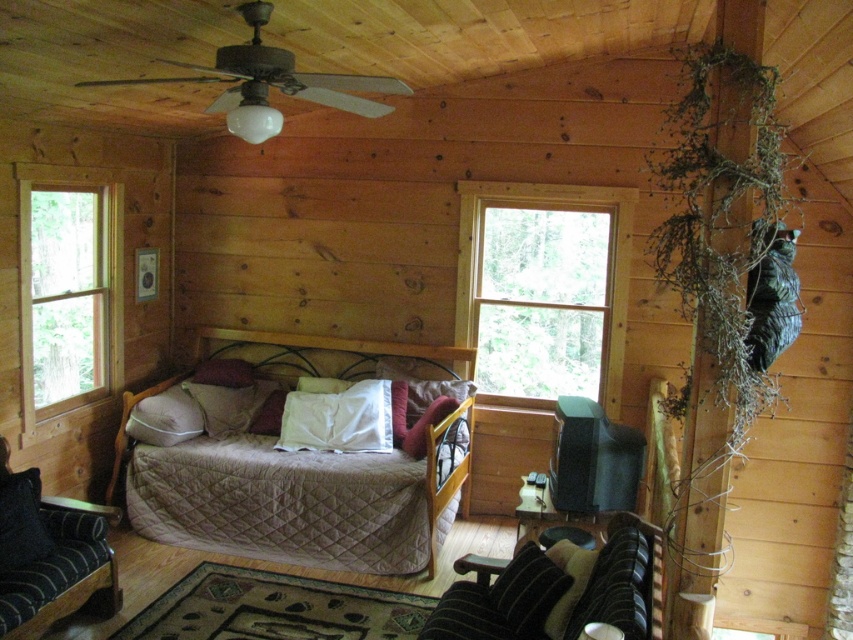
Question: Among these points, which one is nearest to the camera?

Choices:
 (A) (300, 392)
 (B) (509, 579)
 (C) (173, 406)
 (D) (334, 337)

Answer: (B)

Question: Where is clear glass window at left located in relation to white soft pillow at center in the image?

Choices:
 (A) above
 (B) below

Answer: (A)

Question: Which point is farther to the camera?

Choices:
 (A) (386, 385)
 (B) (184, 428)

Answer: (A)

Question: Which object is the closest to the white soft pillow at center?

Choices:
 (A) black textured pillow at lower center
 (B) white matte pillow at center

Answer: (B)

Question: Does clear glass window at upper center have a greater width compared to clear glass window at left?

Choices:
 (A) no
 (B) yes

Answer: (B)

Question: Is clear glass window at upper center below black textured pillow at lower center?

Choices:
 (A) yes
 (B) no

Answer: (B)